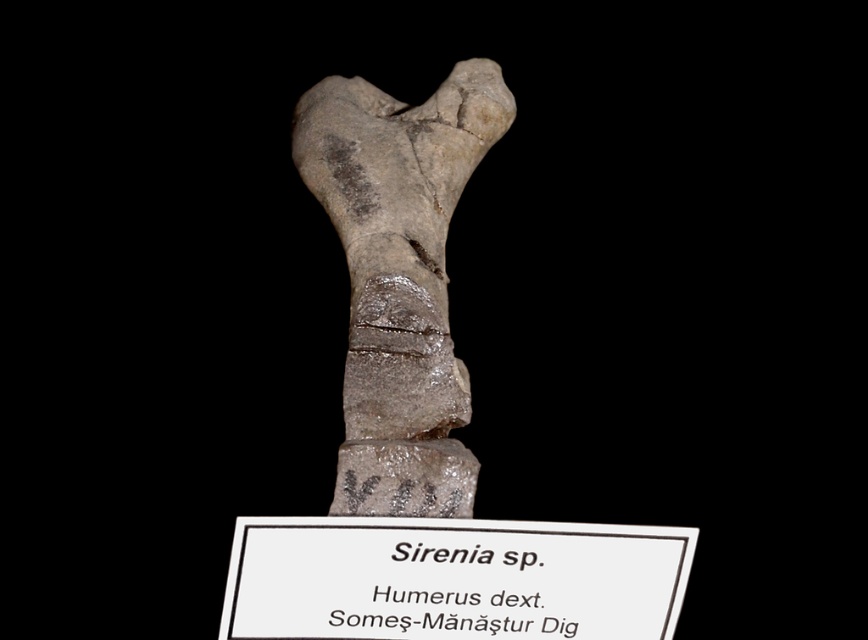
Question: Is gray stone humerus at center above white paper at center?

Choices:
 (A) no
 (B) yes

Answer: (B)

Question: Is gray stone humerus at center to the left of white paper at center from the viewer's perspective?

Choices:
 (A) yes
 (B) no

Answer: (A)

Question: Can you confirm if gray stone humerus at center is positioned below white paper at center?

Choices:
 (A) yes
 (B) no

Answer: (B)

Question: Which of the following is the farthest from the observer?

Choices:
 (A) (474, 573)
 (B) (436, 218)

Answer: (B)

Question: Among these objects, which one is nearest to the camera?

Choices:
 (A) white paper at center
 (B) gray stone humerus at center

Answer: (A)